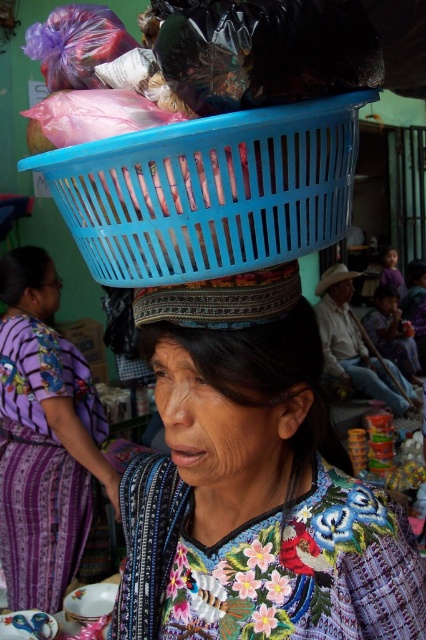
Where is the embroidered fabric at center located in the image?

The embroidered fabric at center is located at point (255, 484) in the image.

Based on the photo, you are a photographer standing at the center of the market. You want to capture the blue plastic basket at center in your photo. If your camera has a focal length of 50mm and you are 2 meters away from the basket, will the basket fill the frame vertically? The sensor size of your camera is 24mm x 36mm.

The blue plastic basket at center is located at coordinates (209, 192) in the image. To determine if it fills the frame vertically, we calculate the sensor height of 24mm. Using the formula field of view height equals 2 times tangent of half the focal length divided by distance, but since exact dimensions aren

You are a photographer at the market and want to capture a photo that includes both the matte purple dress at lower left and the matte brown hat at center. Based on their positions, which object should you focus on first to ensure both are in the frame?

The matte purple dress at lower left is located below the matte brown hat at center, so you should focus on the matte brown hat at center first to ensure both are in the frame.